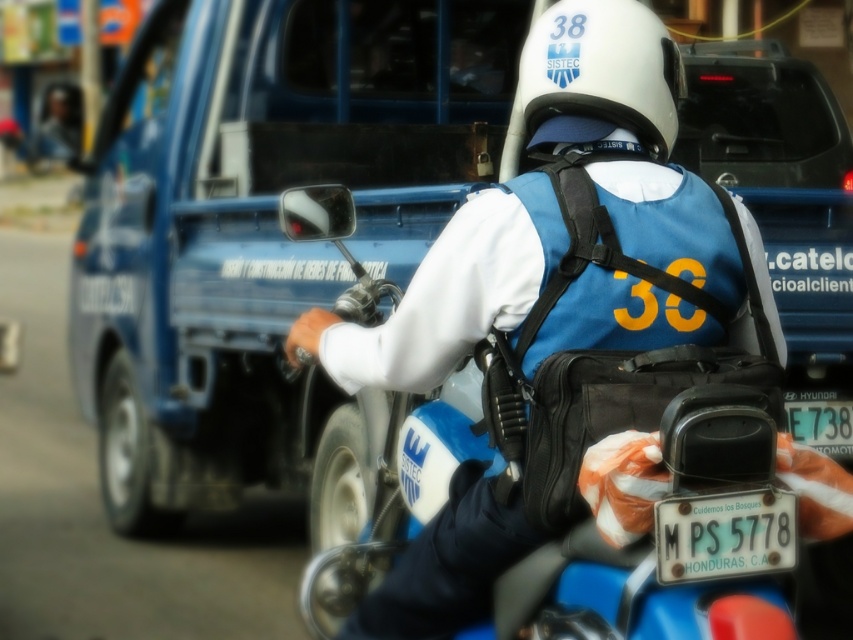
Does white plastic license plate at center have a greater width compared to white plastic license plate at lower right?

Indeed, white plastic license plate at center has a greater width compared to white plastic license plate at lower right.

Is point (787, 492) closer to viewer compared to point (810, 428)?

Yes.

This screenshot has width=853, height=640. Identify the location of white plastic license plate at center. (724, 532).

Is blue matte motorcycle at center above white plastic license plate at center?

No.

Measure the distance between blue matte motorcycle at center and white plastic license plate at center.

13.24 inches

Is point (585, 228) farther from viewer compared to point (733, 557)?

Yes, it is.

Where is `blue matte motorcycle at center`? This screenshot has width=853, height=640. blue matte motorcycle at center is located at coordinates (610, 422).

Is blue matte motorcycle at center taller than white plastic license plate at lower right?

Correct, blue matte motorcycle at center is much taller as white plastic license plate at lower right.

Who is more distant from viewer, (711, 362) or (843, 419)?

Point (843, 419)

Does point (560, 182) come in front of point (834, 396)?

Yes, point (560, 182) is closer to viewer.

Locate an element on the screen. blue matte motorcycle at center is located at coordinates (610, 422).